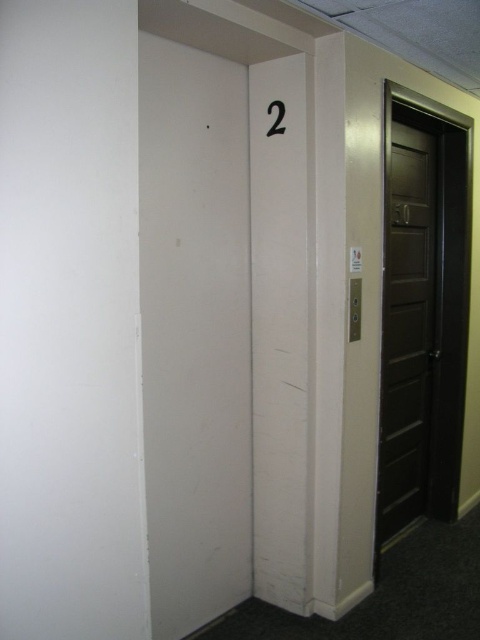
You are a delivery person carrying a package that requires a height clearance of 2 meters. You see the dark brown wooden door at right and the black paper at upper center. Which object is taller and can accommodate the package?

The dark brown wooden door at right is taller than the black paper at upper center. However, the height of the door itself is not specified, so it is unclear if it can accommodate the package requiring 2 meters of clearance.

You are standing in the hallway and need to determine the relative positions of two points marked in the scene. Which point is closer to you, point 1 at coordinates point 1 at coordinates point (428, 396) or point (274, 134)?

Point (274, 134) is closer to you because it is less further to the viewer than point (428, 396).